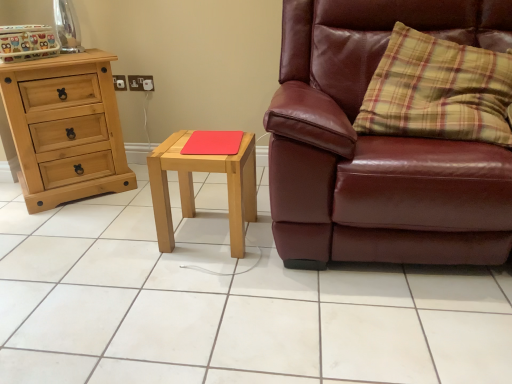
You are a GUI agent. You are given a task and a screenshot of the screen. Output one action in this format:
    pyautogui.click(x=<x>, y=<y>)
    Task: Click on the vacant space that is to the left of leather couch at right
    This screenshot has height=384, width=512.
    Given the screenshot: What is the action you would take?
    pyautogui.click(x=154, y=273)